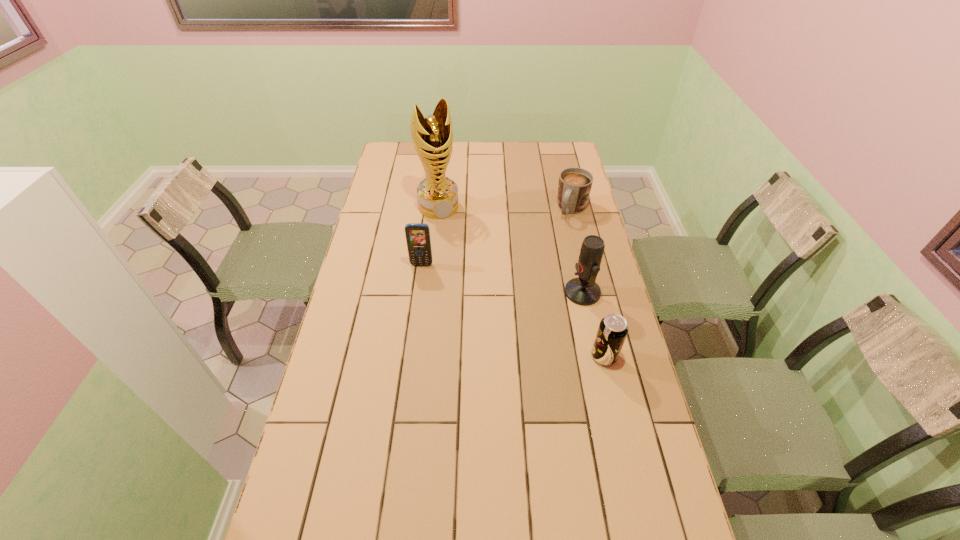
This screenshot has width=960, height=540. I want to click on free space in the image that satisfies the following two spatial constraints: 1. on the screen of the third nearest object; 2. on the left side of the fourth farthest object, so coord(418,292).

Find the location of a particular element. The width and height of the screenshot is (960, 540). vacant space that satisfies the following two spatial constraints: 1. on the front side of the tallest object; 2. on the right side of the soda can is located at coordinates (422, 356).

Identify the location of free spot that satisfies the following two spatial constraints: 1. on the back side of the soda can; 2. on the left side of the mug. (570, 210).